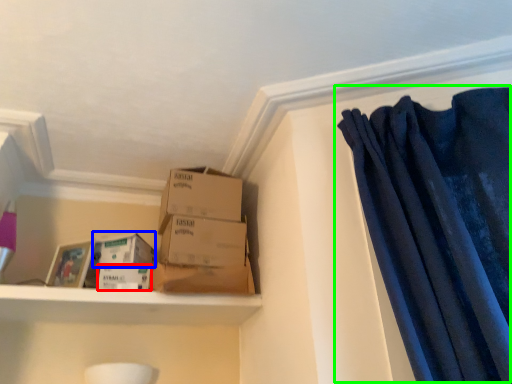
Question: Based on their relative distances, which object is nearer to storage box (highlighted by a red box)? Choose from storage box (highlighted by a blue box) and curtain (highlighted by a green box).

Choices:
 (A) storage box
 (B) curtain

Answer: (A)